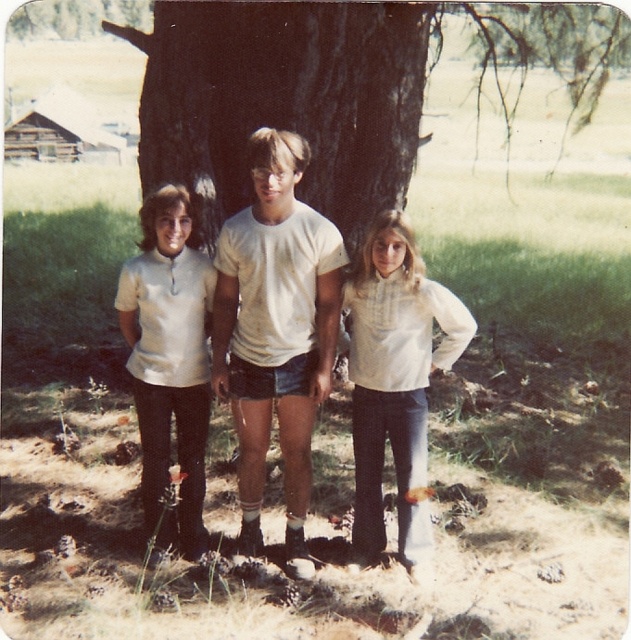
Question: Is white cotton t-shirt at center thinner than white cotton shirt at center?

Choices:
 (A) no
 (B) yes

Answer: (A)

Question: Is white cotton t-shirt at center smaller than matte white shirt at center?

Choices:
 (A) yes
 (B) no

Answer: (B)

Question: Which of the following is the closest to the observer?

Choices:
 (A) white cotton t-shirt at center
 (B) matte white shirt at center

Answer: (A)

Question: Which point is farther to the camera?

Choices:
 (A) white cotton shirt at center
 (B) white cotton t-shirt at center
 (C) matte white shirt at center

Answer: (C)

Question: Which point is farther to the camera?

Choices:
 (A) (227, 368)
 (B) (360, 513)
 (C) (160, 544)

Answer: (B)

Question: Is white cotton t-shirt at center smaller than white cotton shirt at center?

Choices:
 (A) no
 (B) yes

Answer: (A)